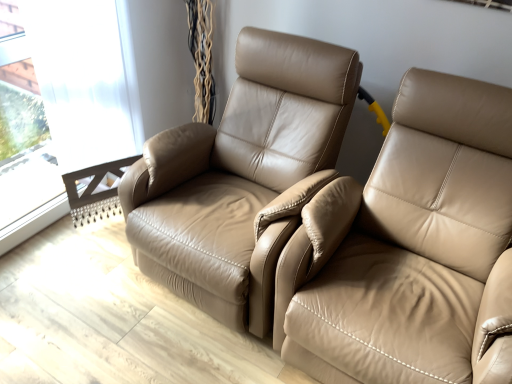
Question: Is transparent glass window at upper left spatially inside beige leather recliner at right, or outside of it?

Choices:
 (A) inside
 (B) outside

Answer: (B)

Question: In terms of width, does transparent glass window at upper left look wider or thinner when compared to beige leather recliner at right?

Choices:
 (A) thin
 (B) wide

Answer: (A)

Question: Which object is the closest to the transparent glass window at upper left?

Choices:
 (A) tan leather chair at center
 (B) beige leather recliner at right

Answer: (A)

Question: Which is farther from the transparent glass window at upper left?

Choices:
 (A) tan leather chair at center
 (B) beige leather recliner at right

Answer: (B)